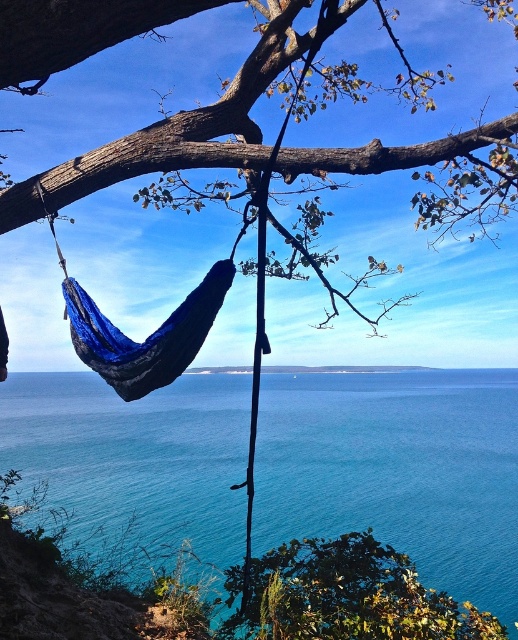
Question: Is brown rough tree branch at upper center smaller than blue knitted hammock at lower left?

Choices:
 (A) yes
 (B) no

Answer: (B)

Question: Is brown rough tree branch at upper center below blue knitted hammock at lower left?

Choices:
 (A) yes
 (B) no

Answer: (B)

Question: Which point is closer to the camera taking this photo?

Choices:
 (A) (165, 144)
 (B) (77, 308)

Answer: (A)

Question: Which object appears closest to the camera in this image?

Choices:
 (A) blue knitted hammock at lower left
 (B) brown rough tree branch at upper center

Answer: (B)

Question: Is blue water at center smaller than green leafy tree at lower center?

Choices:
 (A) no
 (B) yes

Answer: (A)

Question: Which object is closer to the camera taking this photo?

Choices:
 (A) blue water at center
 (B) brown rough tree branch at upper center
 (C) blue knitted hammock at lower left

Answer: (B)